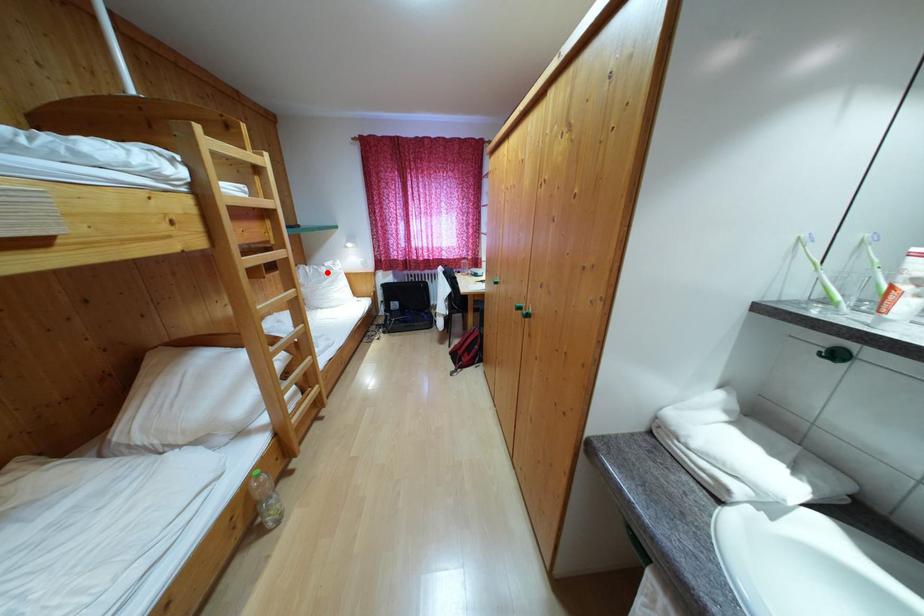
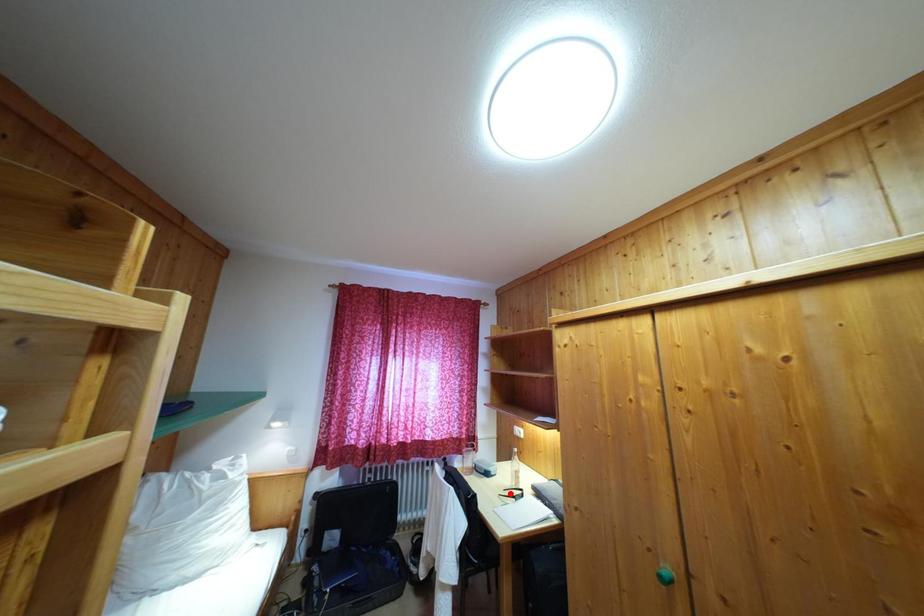
I am providing you with two images of the same scene from different viewpoints. A red point is marked on the first image and another point is marked on the second image. Are the points marked in image1 and image2 representing the same 3D position?

No